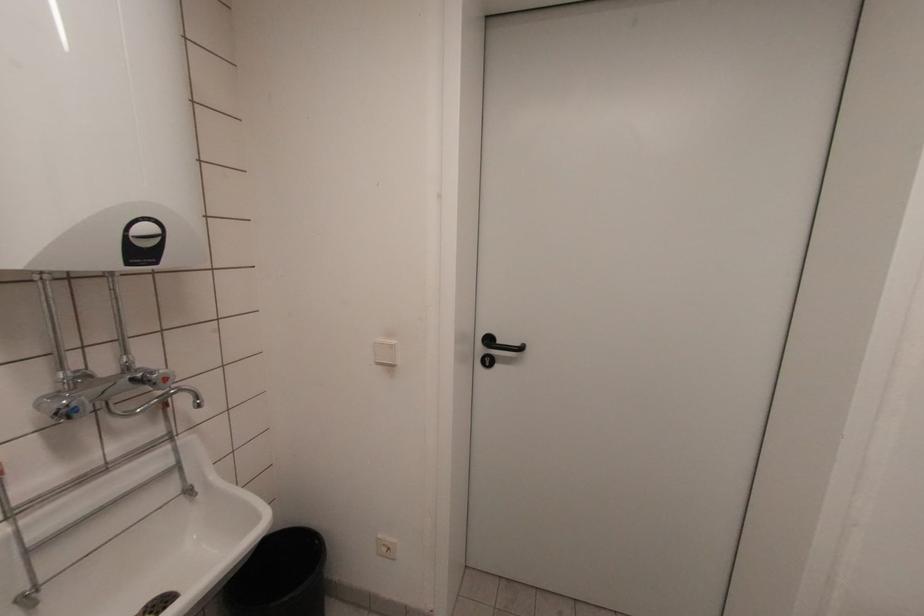
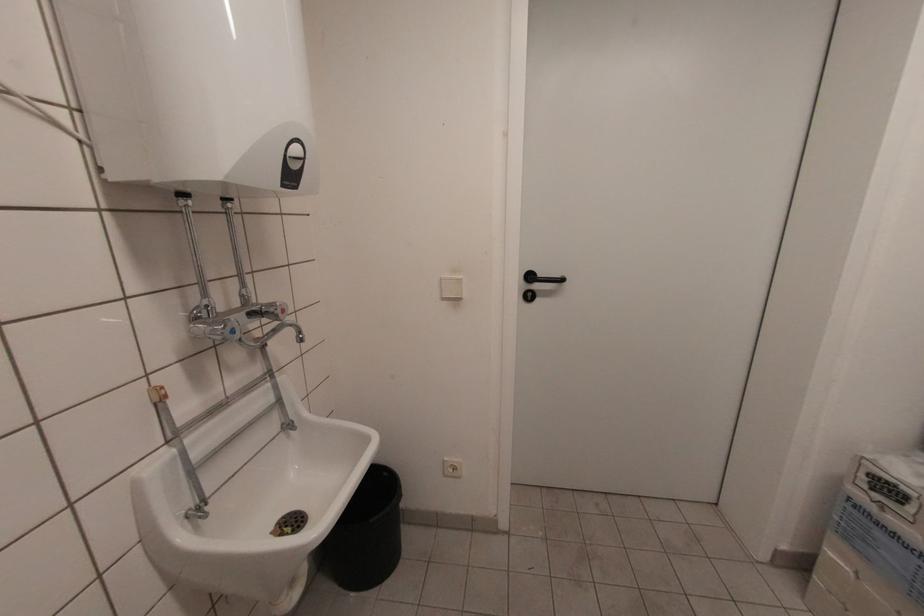
Question: Based on the continuous images, in which direction is the camera rotating? Reply with the corresponding letter.

Choices:
 (A) Left
 (B) Right
 (C) Up
 (D) Down

Answer: (B)